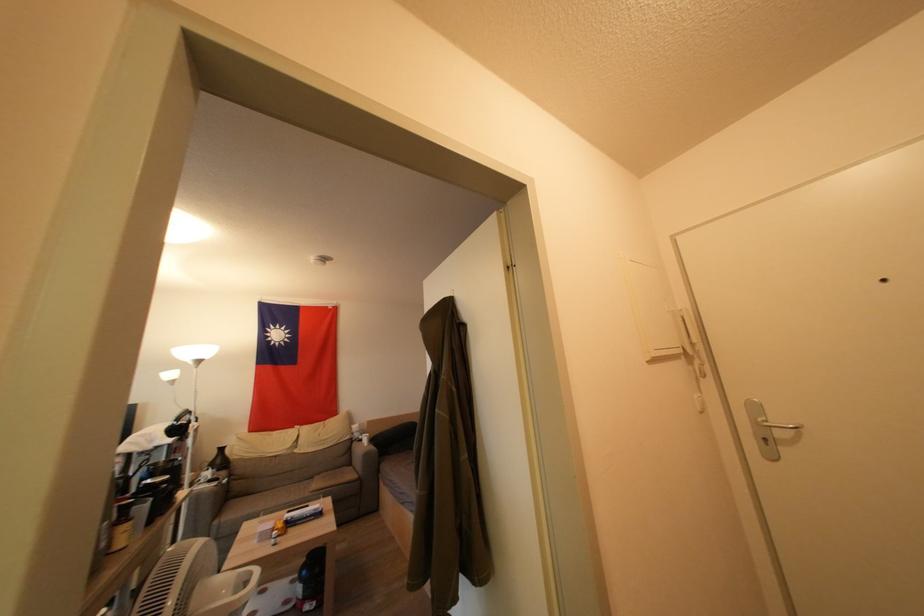
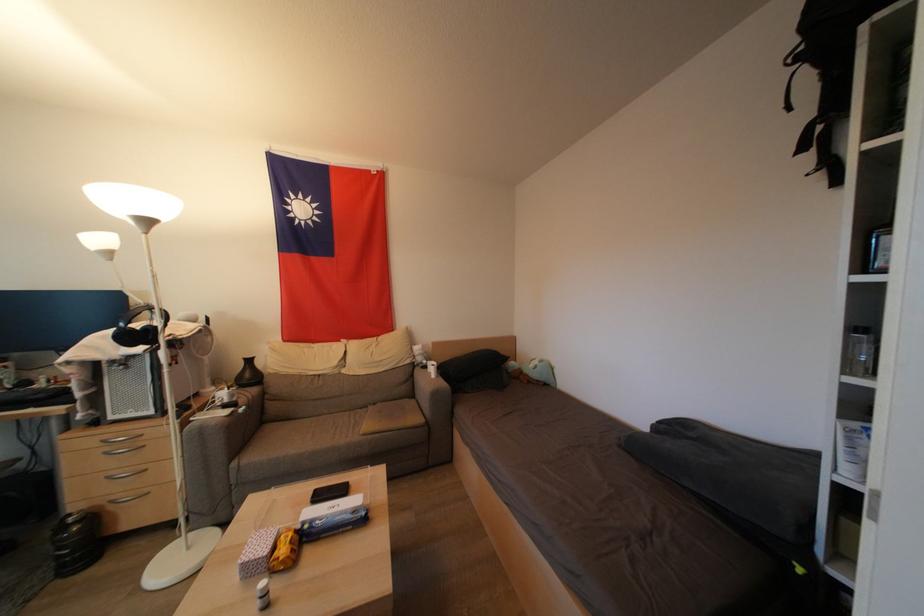
Where in the second image is the point corresponding to (x=203, y=365) from the first image?

(152, 225)